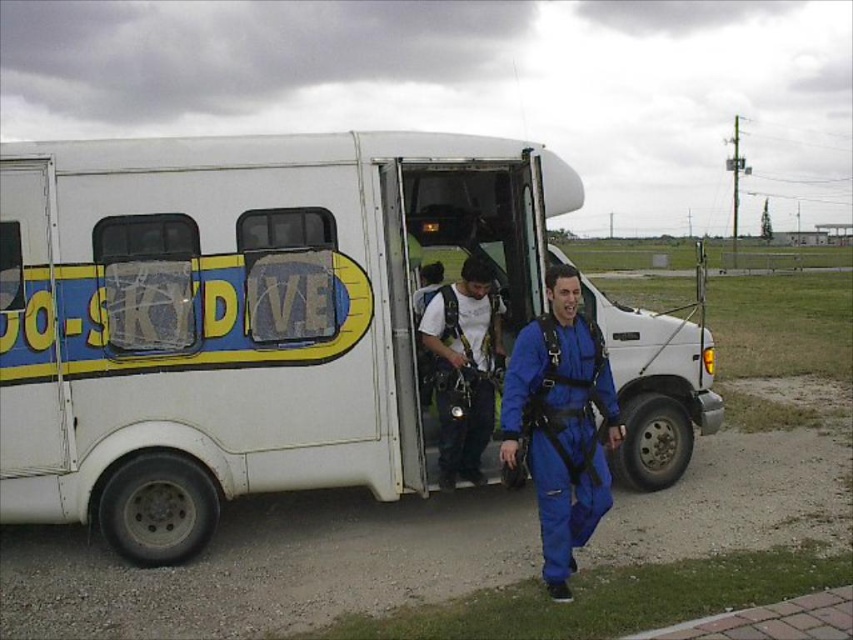
Question: Which of the following is the farthest from the observer?

Choices:
 (A) (55, 508)
 (B) (554, 480)

Answer: (A)

Question: Which object is positioned farthest from the blue fabric jumpsuit at center?

Choices:
 (A) white matte van at center
 (B) blue matte jumpsuit at center

Answer: (B)

Question: Is white matte van at center positioned before blue matte jumpsuit at center?

Choices:
 (A) no
 (B) yes

Answer: (A)

Question: Which of the following is the farthest from the observer?

Choices:
 (A) (438, 348)
 (B) (605, 428)

Answer: (A)

Question: Is white matte van at center to the right of blue matte jumpsuit at center from the viewer's perspective?

Choices:
 (A) no
 (B) yes

Answer: (A)

Question: Does blue matte jumpsuit at center appear over blue fabric jumpsuit at center?

Choices:
 (A) no
 (B) yes

Answer: (A)